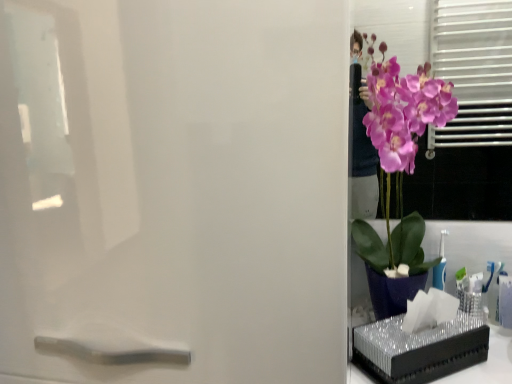
What do you see at coordinates (174, 190) in the screenshot? This screenshot has height=384, width=512. I see `satin white screen door at right` at bounding box center [174, 190].

Locate an element on the screen. satin white screen door at right is located at coordinates (174, 190).

Considering the relative sizes of satin white screen door at right and purple glossy orchid at right in the image provided, is satin white screen door at right wider than purple glossy orchid at right?

Yes, satin white screen door at right is wider than purple glossy orchid at right.

From the image's perspective, which is below, satin white screen door at right or purple glossy orchid at right?

satin white screen door at right appears lower in the image.

From the image's perspective, between metallic silver tissue box at right and purple glossy orchid at right, which one is located above?

purple glossy orchid at right, from the image's perspective.

Between metallic silver tissue box at right and purple glossy orchid at right, which one appears on the left side from the viewer's perspective?

Positioned to the left is purple glossy orchid at right.

Is metallic silver tissue box at right far away from purple glossy orchid at right?

They are positioned close to each other.

Is metallic silver tissue box at right further to the viewer compared to purple glossy orchid at right?

That is True.

Which of these two, metallic silver tissue box at right or satin white screen door at right, is wider?

Wider between the two is satin white screen door at right.

From a real-world perspective, between metallic silver tissue box at right and satin white screen door at right, who is vertically higher?

satin white screen door at right.

In the scene shown: Between metallic silver tissue box at right and satin white screen door at right, which one has smaller size?

metallic silver tissue box at right.

From the picture: Would you say metallic silver tissue box at right is inside or outside satin white screen door at right?

metallic silver tissue box at right is outside satin white screen door at right.

Can you confirm if purple glossy orchid at right is positioned to the right of satin white screen door at right?

Correct, you'll find purple glossy orchid at right to the right of satin white screen door at right.

In the scene shown: How different are the orientations of purple glossy orchid at right and satin white screen door at right in degrees?

There is a 2.1-degree angle between the facing directions of purple glossy orchid at right and satin white screen door at right.

Is the position of purple glossy orchid at right less distant than that of satin white screen door at right?

No, purple glossy orchid at right is further to the viewer.

Is purple glossy orchid at right facing away from satin white screen door at right?

No.

Considering the positions of points (414, 130) and (386, 354), is point (414, 130) closer to camera compared to point (386, 354)?

No, it is not.

Based on the photo, is purple glossy orchid at right facing away from metallic silver tissue box at right?

purple glossy orchid at right does not have its back to metallic silver tissue box at right.

What's the angular difference between purple glossy orchid at right and metallic silver tissue box at right's facing directions?

The facing directions of purple glossy orchid at right and metallic silver tissue box at right are 33.5 degrees apart.

Is purple glossy orchid at right situated inside metallic silver tissue box at right or outside?

purple glossy orchid at right is spatially situated outside metallic silver tissue box at right.

Is satin white screen door at right facing away from metallic silver tissue box at right?

satin white screen door at right is not turned away from metallic silver tissue box at right.

Can you confirm if satin white screen door at right is smaller than metallic silver tissue box at right?

Incorrect, satin white screen door at right is not smaller in size than metallic silver tissue box at right.

Looking at this image, considering the relative sizes of satin white screen door at right and metallic silver tissue box at right in the image provided, is satin white screen door at right taller than metallic silver tissue box at right?

Yes.

In the image, is satin white screen door at right positioned in front of or behind metallic silver tissue box at right?

Visually, satin white screen door at right is located in front of metallic silver tissue box at right.

Find the location of a particular element. This screenshot has width=512, height=384. screen door that appears below the purple glossy orchid at right (from a real-world perspective) is located at coordinates (174, 190).

In order to click on houseplant on the left of metallic silver tissue box at right in this screenshot , I will do `click(398, 175)`.

Estimate the real-world distances between objects in this image. Which object is further from metallic silver tissue box at right, satin white screen door at right or purple glossy orchid at right?

satin white screen door at right is further to metallic silver tissue box at right.

Consider the image. Which object lies further to the anchor point satin white screen door at right, metallic silver tissue box at right or purple glossy orchid at right?

metallic silver tissue box at right lies further to satin white screen door at right than the other object.

Looking at the image, which one is located further to purple glossy orchid at right, metallic silver tissue box at right or satin white screen door at right?

satin white screen door at right.

When comparing their distances from satin white screen door at right, does purple glossy orchid at right or metallic silver tissue box at right seem further?

metallic silver tissue box at right is further to satin white screen door at right.

Estimate the real-world distances between objects in this image. Which object is further from metallic silver tissue box at right, purple glossy orchid at right or satin white screen door at right?

satin white screen door at right lies further to metallic silver tissue box at right than the other object.

Looking at the image, which one is located closer to purple glossy orchid at right, satin white screen door at right or metallic silver tissue box at right?

metallic silver tissue box at right.

Find the location of a particular element. This screenshot has width=512, height=384. houseplant between satin white screen door at right and metallic silver tissue box at right from left to right is located at coordinates (398, 175).